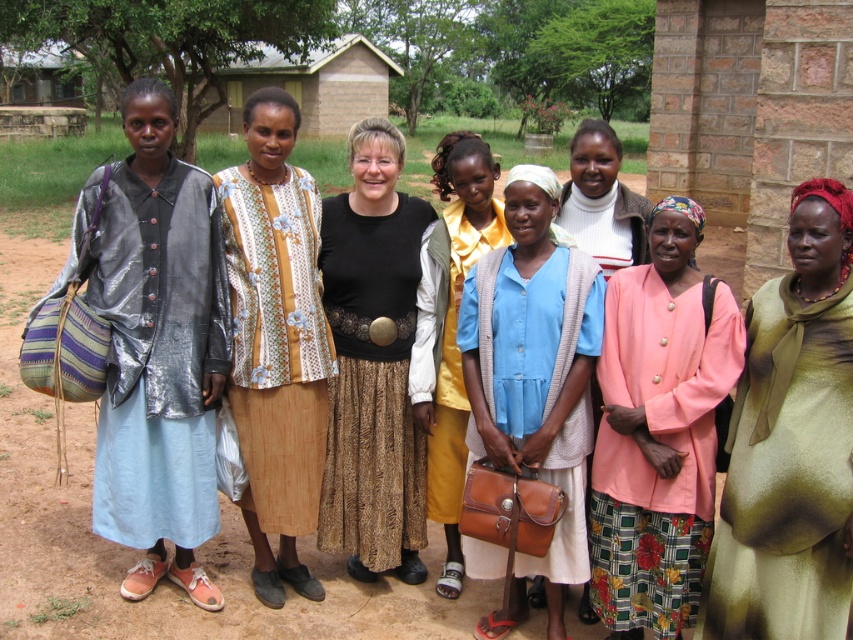
Looking at this image, you are an observer trying to distinguish between two clothing items in the scene. The pink fabric coat at center and the blue fabric shirt at center are both visible. Which clothing item is shorter?

The pink fabric coat at center is shorter than the blue fabric shirt at center.

You are a photographer trying to capture a group photo of the women. You notice the pink fabric coat at center and the blue fabric shirt at center. Since you want to ensure both are visible in the frame, which clothing item might you ask the person wearing it to adjust so that it doesn,t obstruct the other?

The pink fabric coat at center has a smaller width than the blue fabric shirt at center. Therefore, the person wearing the blue fabric shirt at center might need to adjust their position or clothing to prevent it from potentially covering the pink fabric coat at center due to its wider size.